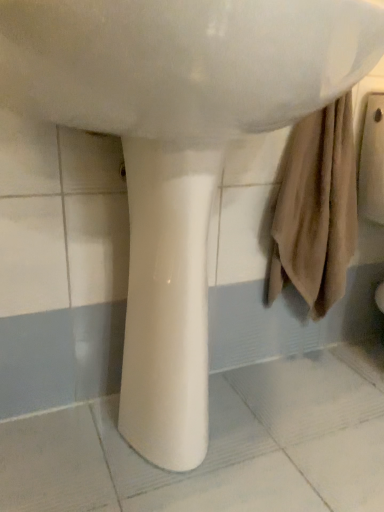
Identify the location of vacant space in front of white glossy pedestal at center. (157, 494).